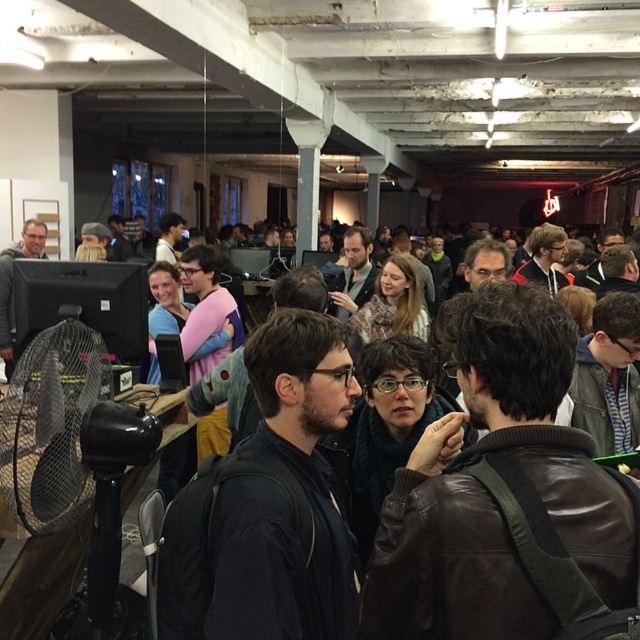
Question: Can you confirm if leather jacket at center is positioned to the right of metallic grid fan at lower left?

Choices:
 (A) yes
 (B) no

Answer: (A)

Question: Can you confirm if black plastic fan at left is thinner than matte black monitor at left?

Choices:
 (A) no
 (B) yes

Answer: (B)

Question: Which of these objects is positioned closest to the black matte jacket at center?

Choices:
 (A) leather jacket at center
 (B) matte black jacket at center

Answer: (B)

Question: Is matte black jacket at center to the right of black matte jacket at center from the viewer's perspective?

Choices:
 (A) yes
 (B) no

Answer: (A)

Question: Which object appears closest to the camera in this image?

Choices:
 (A) black matte jacket at center
 (B) black plastic fan at left
 (C) matte black monitor at left
 (D) leather jacket at center

Answer: (D)

Question: Among these objects, which one is farthest from the camera?

Choices:
 (A) black plastic fan at left
 (B) matte black monitor at left

Answer: (B)